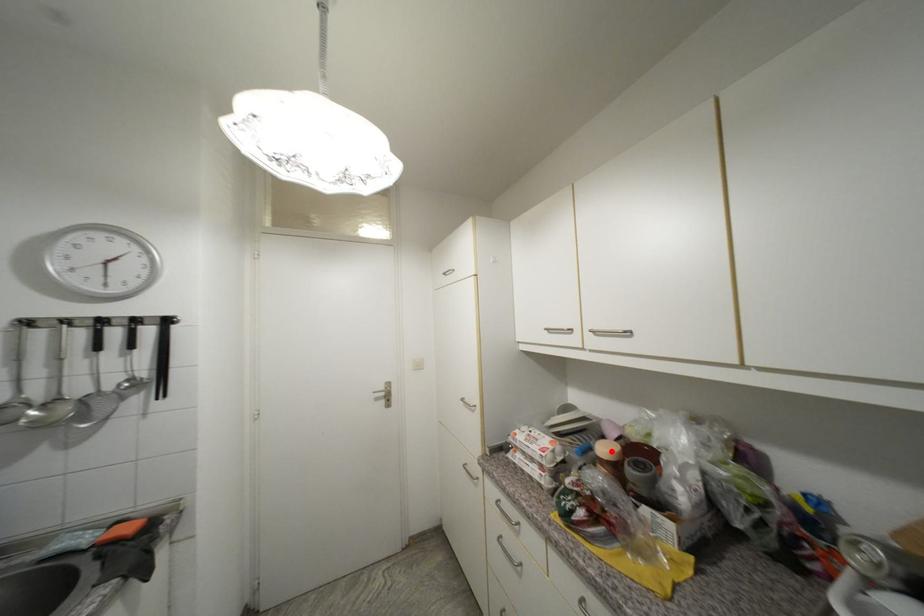
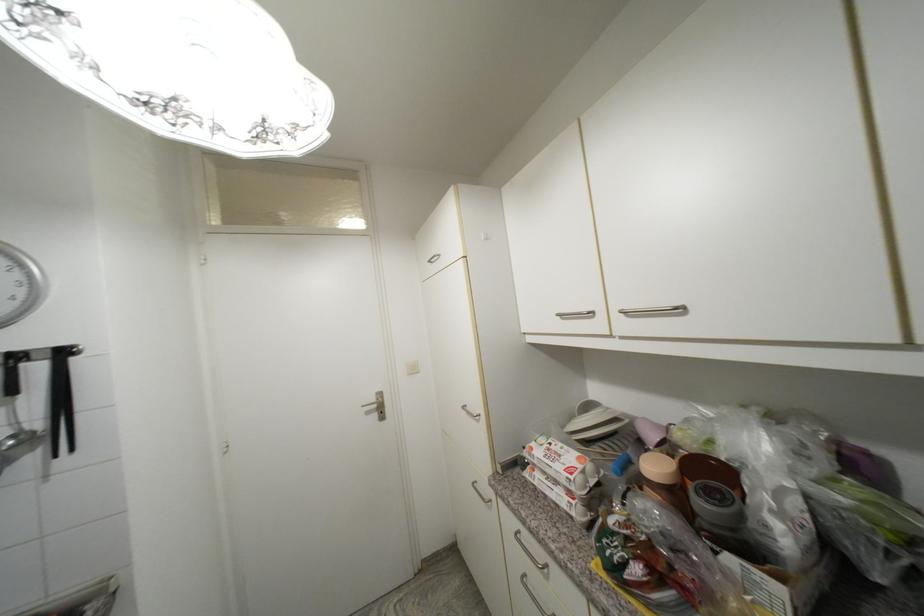
Where in the second image is the point corresponding to the highlighted location from the first image?

(662, 469)